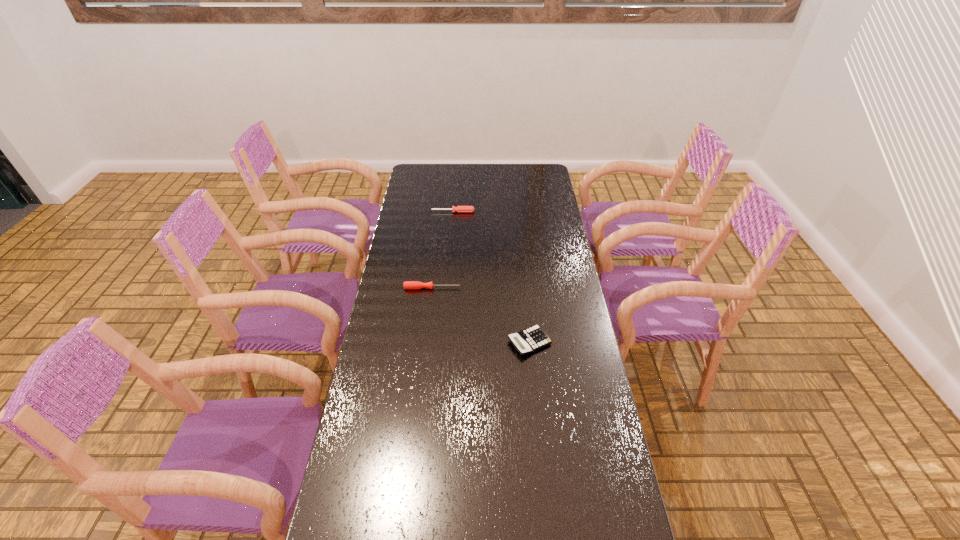
Locate an element on the screen. This screenshot has width=960, height=540. vacant region that satisfies the following two spatial constraints: 1. at the tip of the nearer screwdriver; 2. on the left side of the calculator is located at coordinates pyautogui.click(x=426, y=342).